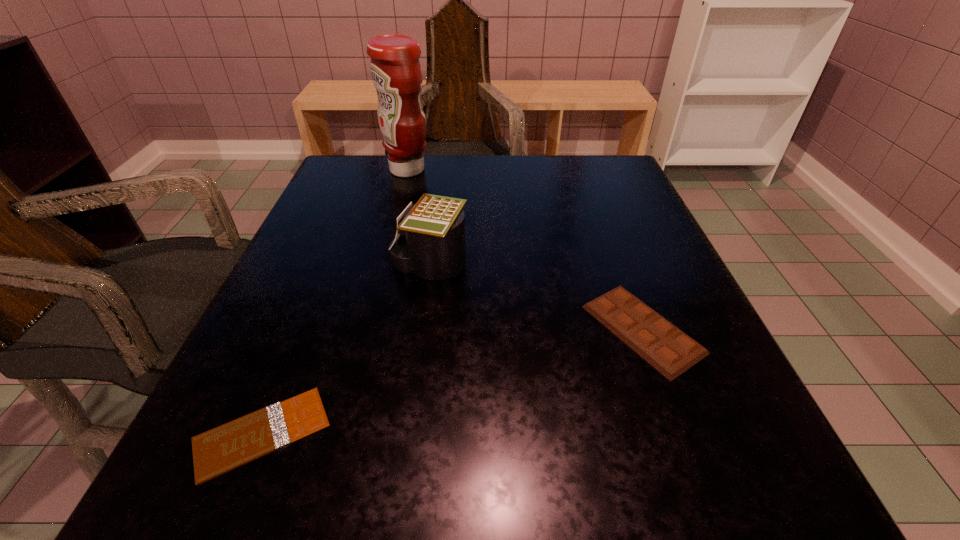
Find the location of `the tallest object`. the tallest object is located at coordinates (396, 73).

What are the coordinates of `condiment` in the screenshot? It's located at (396, 73).

Where is `the second tallest object`? Image resolution: width=960 pixels, height=540 pixels. the second tallest object is located at coordinates (433, 248).

Image resolution: width=960 pixels, height=540 pixels. I want to click on the third tallest object, so click(669, 350).

I want to click on the rightmost object, so click(x=669, y=350).

At what (x,y) coordinates should I click in order to perform the action: click on the shortest object. Please return your answer as a coordinate pair (x, y). The image size is (960, 540). Looking at the image, I should click on (217, 451).

At what (x,y) coordinates should I click in order to perform the action: click on the shorter chocolate bar. Please return your answer as a coordinate pair (x, y). The image size is (960, 540). Looking at the image, I should click on (217, 451).

The height and width of the screenshot is (540, 960). What are the coordinates of `free spot located on the front of the tallest object` in the screenshot? It's located at (399, 202).

The width and height of the screenshot is (960, 540). Identify the location of free region located 0.300m on the front of the third shortest object. (403, 456).

Locate an element on the screen. This screenshot has width=960, height=540. free space located on the back of the third tallest object is located at coordinates (586, 178).